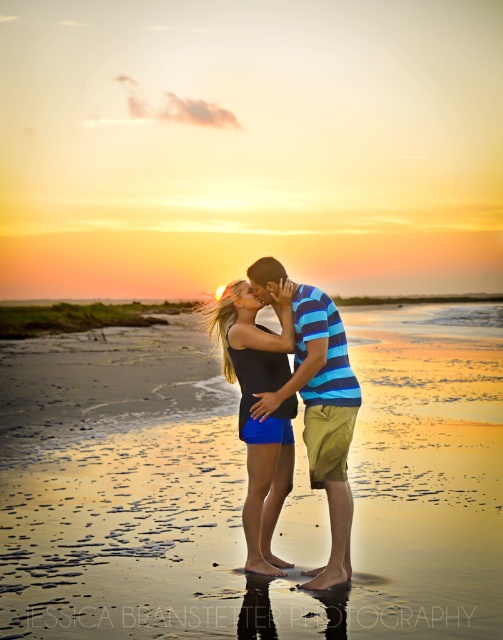
You are a photographer trying to capture the sunset on the sandy beach at center while also including the striped cotton shirt at center in the frame. Based on their distance apart, can you estimate whether a standard 50mm lens will allow both subjects to be in the frame without needing to zoom in or out?

The distance between the sandy beach at center and striped cotton shirt at center is 8.51 meters. A standard 50mm lens has a field of view that can typically capture subjects within a range of about 6 meters at a comfortable shooting distance. Since the separation is greater than this, the photographer would likely need to use a wider lens or adjust their position to include both in the frame.

Where is the sandy beach at center located in the image?

The sandy beach at center is located at point (244, 486) in the image.

You are standing at the point marked as point [312,518] on the beach. If you want to walk directly towards the sunset, which direction should you face?

The sunset is in the west, so you should face west to walk directly towards it.